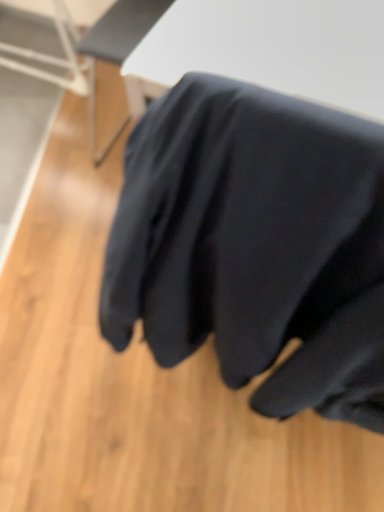
Find the location of a particular element. The height and width of the screenshot is (512, 384). matte black sweatshirt at center is located at coordinates (255, 245).

The height and width of the screenshot is (512, 384). What do you see at coordinates (255, 245) in the screenshot?
I see `matte black sweatshirt at center` at bounding box center [255, 245].

Where is `matte black sweatshirt at center`? The height and width of the screenshot is (512, 384). matte black sweatshirt at center is located at coordinates (255, 245).